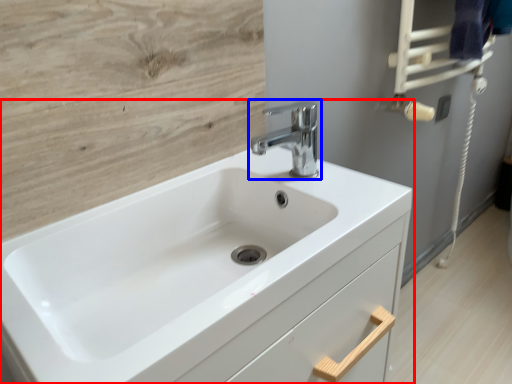
Question: Which point is further to the camera, sink (highlighted by a red box) or tap (highlighted by a blue box)?

Choices:
 (A) sink
 (B) tap

Answer: (B)